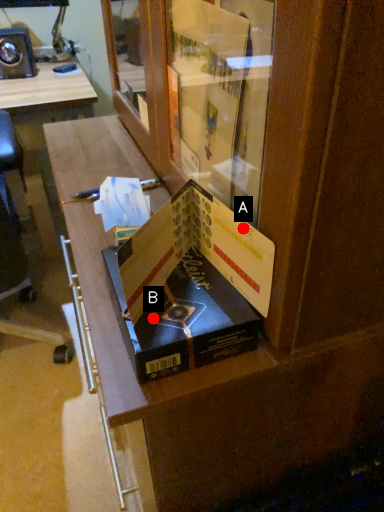
Question: Two points are circled on the image, labeled by A and B beside each circle. Which of the following is the closest to the observer?

Choices:
 (A) A is closer
 (B) B is closer

Answer: (A)